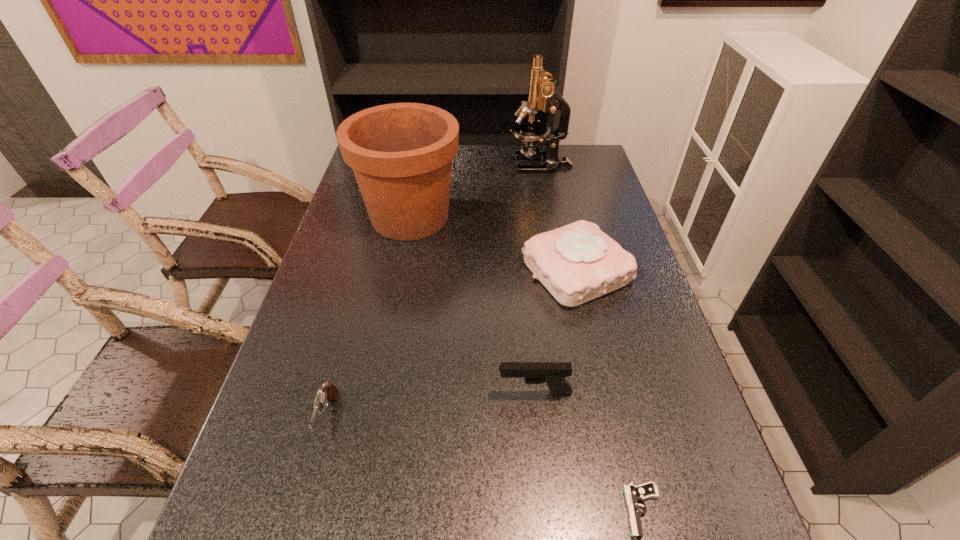
Where is `object that stands as the fourth closest to the flowerpot`? object that stands as the fourth closest to the flowerpot is located at coordinates pos(553,373).

Select which object is the second closest to the second tallest object. Please provide its 2D coordinates. Your answer should be formatted as a tuple, i.e. [(x, y)], where the tuple contains the x and y coordinates of a point satisfying the conditions above.

[(542, 94)]

The width and height of the screenshot is (960, 540). In order to click on pistol that is the closest to the second tallest pistol in this screenshot , I will do `click(553, 373)`.

The image size is (960, 540). Find the location of `pistol identified as the closest to the shortest pistol`. pistol identified as the closest to the shortest pistol is located at coordinates (553, 373).

Where is `free space that satisfies the following two spatial constraints: 1. at the eyepiece of the farthest object; 2. at the barrel of the fifth tallest object`? The height and width of the screenshot is (540, 960). free space that satisfies the following two spatial constraints: 1. at the eyepiece of the farthest object; 2. at the barrel of the fifth tallest object is located at coordinates (588, 417).

Identify the location of free location that satisfies the following two spatial constraints: 1. at the eyepiece of the tallest object; 2. on the front side of the second tallest object. The image size is (960, 540). (550, 217).